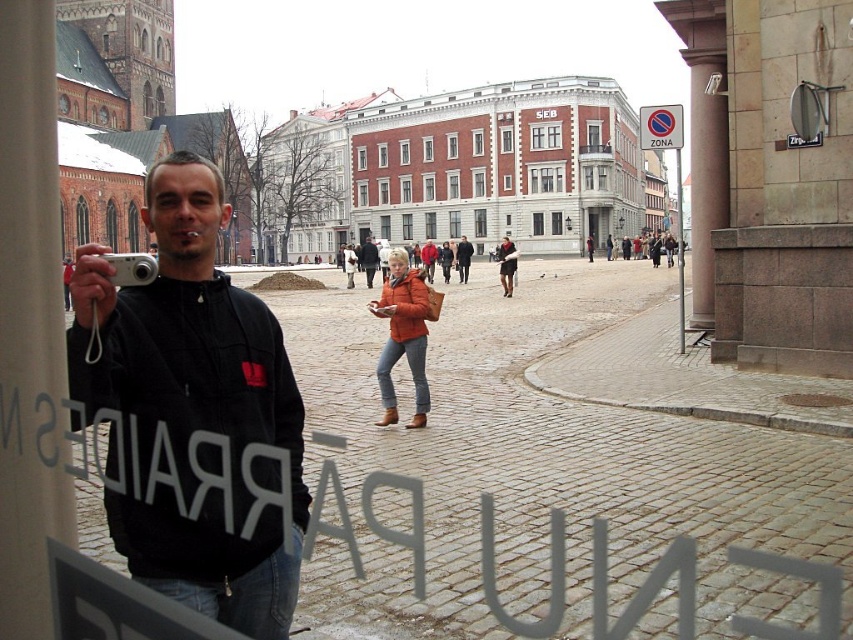
Question: Which point is farther from the camera taking this photo?

Choices:
 (A) (664, 113)
 (B) (204, 227)
 (C) (456, 259)
 (D) (424, 362)

Answer: (C)

Question: Does black corduroy jacket at left have a smaller size compared to red plastic sign at upper center?

Choices:
 (A) yes
 (B) no

Answer: (A)

Question: Which of the following is the farthest from the observer?

Choices:
 (A) (502, 244)
 (B) (369, 250)

Answer: (A)

Question: Observing the image, what is the correct spatial positioning of red plastic sign at upper center in reference to orange leather jacket at center?

Choices:
 (A) left
 (B) right

Answer: (B)

Question: Which point is closer to the camera?

Choices:
 (A) red plastic sign at upper center
 (B) black corduroy jacket at left
 (C) orange matte jacket at center
 (D) orange leather jacket at center

Answer: (B)

Question: In this image, where is orange matte jacket at center located relative to brown leather jacket at center?

Choices:
 (A) right
 (B) left

Answer: (A)